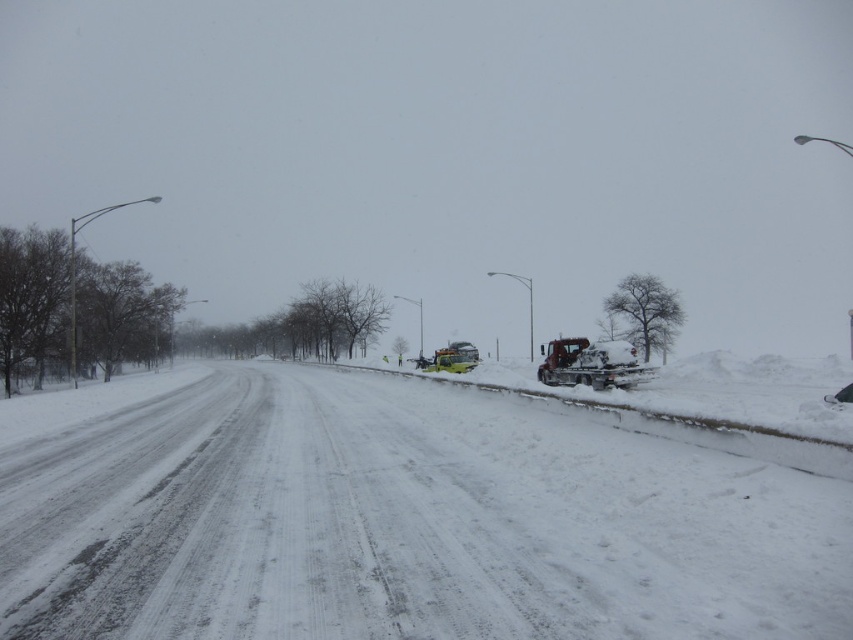
Question: Can you confirm if white powdery snow at road center is smaller than yellow metallic snowplow at center?

Choices:
 (A) yes
 (B) no

Answer: (A)

Question: Considering the real-world distances, which object is closest to the white powdery snow at road center?

Choices:
 (A) yellow metallic snowplow at center
 (B) snow-covered metal snowplow at right

Answer: (B)

Question: Which of the following is the farthest from the observer?

Choices:
 (A) yellow metallic snowplow at center
 (B) white powdery snow at road center

Answer: (A)

Question: Which point is closer to the camera?

Choices:
 (A) (344, 602)
 (B) (553, 355)

Answer: (A)

Question: Can you confirm if white powdery snow at road center is positioned to the right of snow-covered metal snowplow at right?

Choices:
 (A) yes
 (B) no

Answer: (B)

Question: Can you confirm if white powdery snow at road center is positioned above yellow metallic snowplow at center?

Choices:
 (A) yes
 (B) no

Answer: (B)